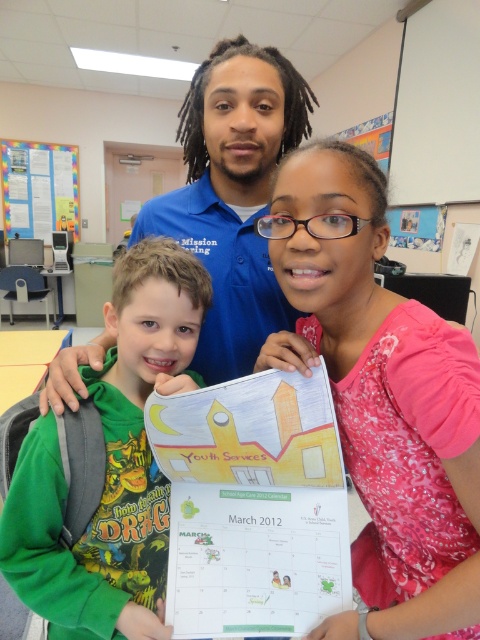
Question: Which object is positioned closest to the green cotton shirt at left?

Choices:
 (A) white matte projector screen at upper right
 (B) pink floral dress at center
 (C) white paperboard bulletin board at upper left

Answer: (B)

Question: Which of the following is the closest to the observer?

Choices:
 (A) pink floral dress at center
 (B) blue cotton shirt at center
 (C) white paperboard bulletin board at upper left
 (D) white matte projector screen at upper right

Answer: (A)

Question: Which of the following is the farthest from the observer?

Choices:
 (A) white matte projector screen at upper right
 (B) green cotton shirt at left
 (C) pink floral dress at center

Answer: (A)

Question: Can you confirm if blue cotton shirt at center is thinner than white paperboard bulletin board at upper left?

Choices:
 (A) no
 (B) yes

Answer: (B)

Question: Considering the relative positions of blue cotton shirt at center and white matte projector screen at upper right in the image provided, where is blue cotton shirt at center located with respect to white matte projector screen at upper right?

Choices:
 (A) below
 (B) above

Answer: (A)

Question: Is pink floral dress at center positioned in front of blue cotton shirt at center?

Choices:
 (A) no
 (B) yes

Answer: (B)